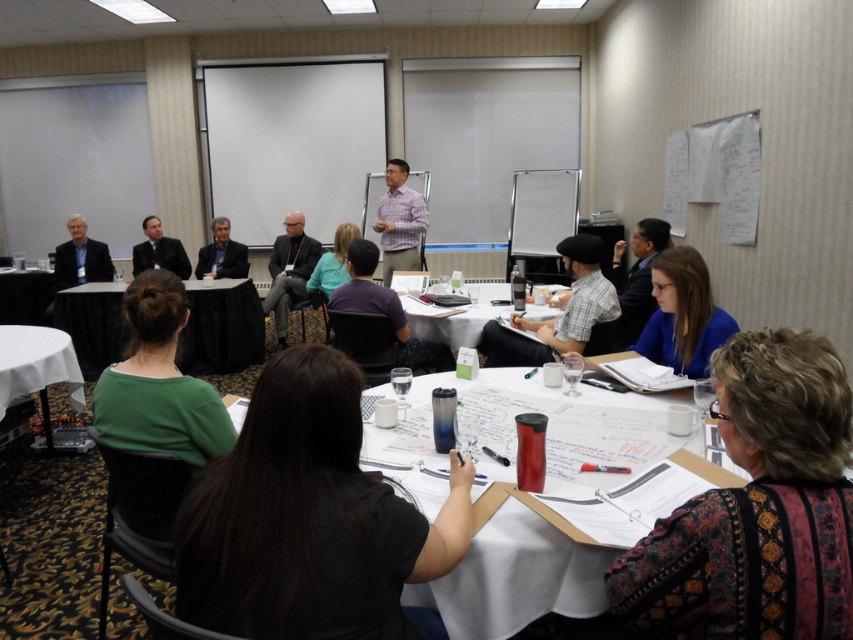
Between blue fabric shirt at lower right and plaid shirt at center, which one is positioned lower?

blue fabric shirt at lower right is lower down.

Does blue fabric shirt at lower right have a lesser width compared to plaid shirt at center?

Indeed, blue fabric shirt at lower right has a lesser width compared to plaid shirt at center.

Does point (700, 358) come behind point (397, 188)?

No, (700, 358) is in front of (397, 188).

You are a GUI agent. You are given a task and a screenshot of the screen. Output one action in this format:
    pyautogui.click(x=<x>, y=<y>)
    Task: Click on the blue fabric shirt at lower right
    The image size is (853, 640).
    Given the screenshot: What is the action you would take?
    pyautogui.click(x=683, y=314)

Between matte black suit at upper right and white paper at center, which one appears on the right side from the viewer's perspective?

matte black suit at upper right

Can you confirm if matte black suit at upper right is shorter than white paper at center?

Incorrect, matte black suit at upper right's height does not fall short of white paper at center's.

Is point (634, 305) positioned in front of point (410, 296)?

Yes.

You are a GUI agent. You are given a task and a screenshot of the screen. Output one action in this format:
    pyautogui.click(x=<x>, y=<y>)
    Task: Click on the matte black suit at upper right
    This screenshot has height=640, width=853.
    Given the screenshot: What is the action you would take?
    pyautogui.click(x=636, y=280)

Can you confirm if black matte water bottle at lower center is bigger than patterned fabric shirt at lower right?

Yes.

Is the position of black matte water bottle at lower center less distant than that of patterned fabric shirt at lower right?

No, black matte water bottle at lower center is further to the viewer.

Image resolution: width=853 pixels, height=640 pixels. Find the location of `black matte water bottle at lower center`. black matte water bottle at lower center is located at coordinates (306, 518).